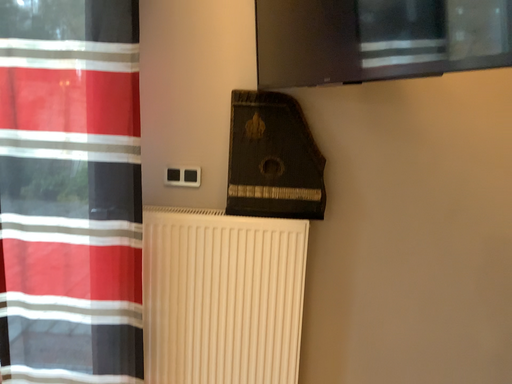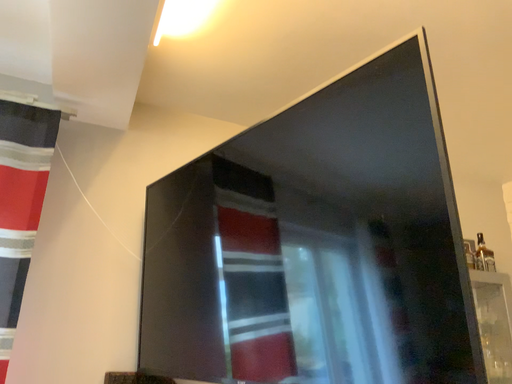
Question: Which way did the camera rotate in the video?

Choices:
 (A) rotated left
 (B) rotated right

Answer: (B)